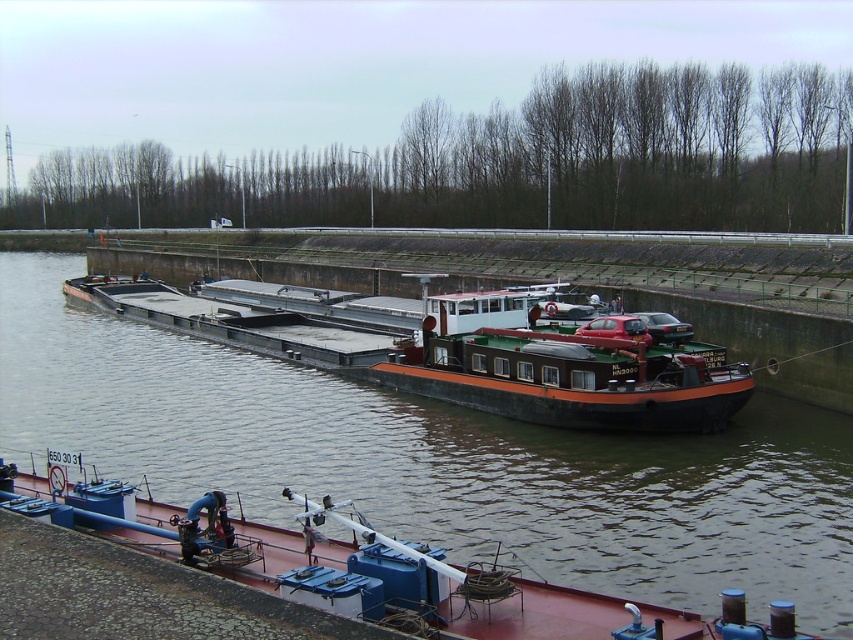
Question: Is brown matte barge at center behind reddish-brown metal barge at lower center?

Choices:
 (A) no
 (B) yes

Answer: (A)

Question: Is brown matte barge at center thinner than reddish-brown metal barge at lower center?

Choices:
 (A) yes
 (B) no

Answer: (B)

Question: Which object appears farthest from the camera in this image?

Choices:
 (A) reddish-brown metal barge at lower center
 (B) brown matte barge at center

Answer: (A)

Question: Which point is farther from the camera taking this photo?

Choices:
 (A) (239, 563)
 (B) (281, 396)

Answer: (B)

Question: Where is brown matte barge at center located in relation to reddish-brown metal barge at lower center in the image?

Choices:
 (A) right
 (B) left

Answer: (B)